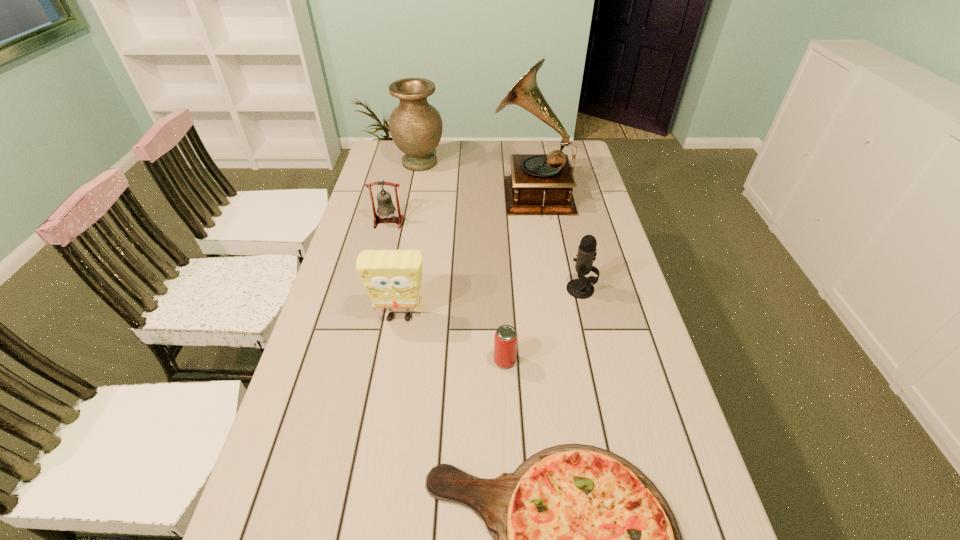
Where is `record player present at the right edge`? Image resolution: width=960 pixels, height=540 pixels. record player present at the right edge is located at coordinates click(539, 183).

Where is `microphone at the right edge`? The width and height of the screenshot is (960, 540). microphone at the right edge is located at coordinates (581, 288).

This screenshot has height=540, width=960. Find the location of `object at the far left corner`. object at the far left corner is located at coordinates (416, 126).

The width and height of the screenshot is (960, 540). I want to click on object located at the far right corner, so click(x=539, y=183).

Find the location of a particular element. free point at the far edge is located at coordinates (520, 143).

The height and width of the screenshot is (540, 960). Find the location of `vacant space at the left edge of the desktop`. vacant space at the left edge of the desktop is located at coordinates (314, 522).

In the image, there is a desktop. Where is `vacant space at the right edge`? The height and width of the screenshot is (540, 960). vacant space at the right edge is located at coordinates (620, 373).

At what (x,y) coordinates should I click in order to perform the action: click on free point between the second tallest object and the bell. Please return your answer as a coordinate pair (x, y). Image resolution: width=960 pixels, height=540 pixels. Looking at the image, I should click on (404, 192).

You are a GUI agent. You are given a task and a screenshot of the screen. Output one action in this format:
    pyautogui.click(x=<x>, y=<y>)
    Task: Click on the blank region between the sixth shortest object and the third nearest object
    The height and width of the screenshot is (540, 960).
    Given the screenshot: What is the action you would take?
    pyautogui.click(x=410, y=240)

Image resolution: width=960 pixels, height=540 pixels. Identify the location of empty space that is in between the bell and the beer can. (446, 292).